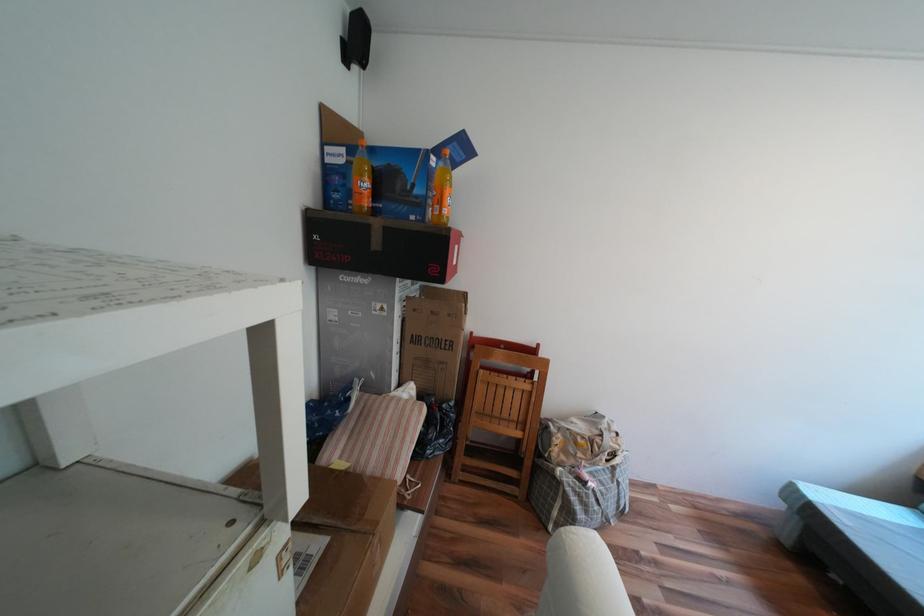
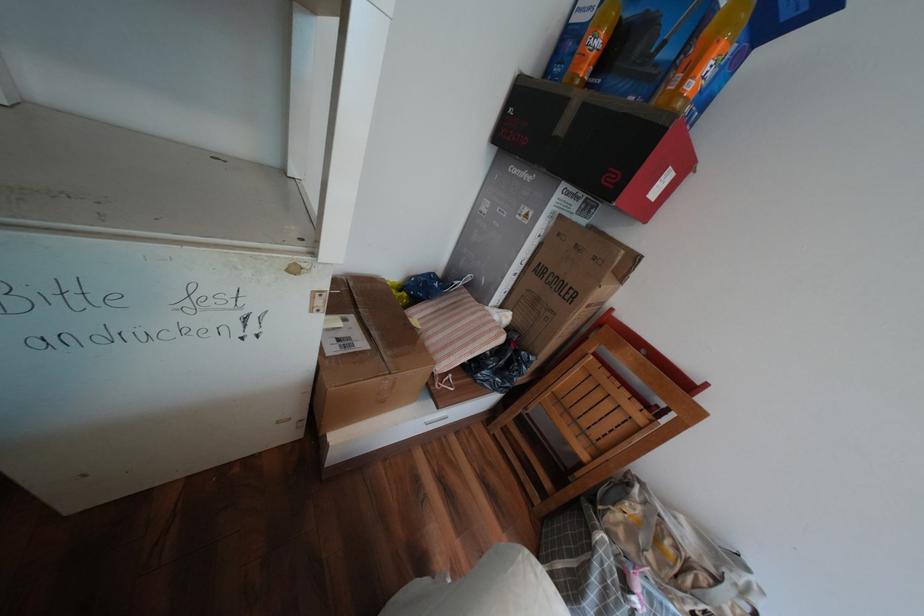
Consider the image. The first image is from the beginning of the video and the second image is from the end. How did the camera likely rotate when shooting the video?

The camera rotated toward left-down.